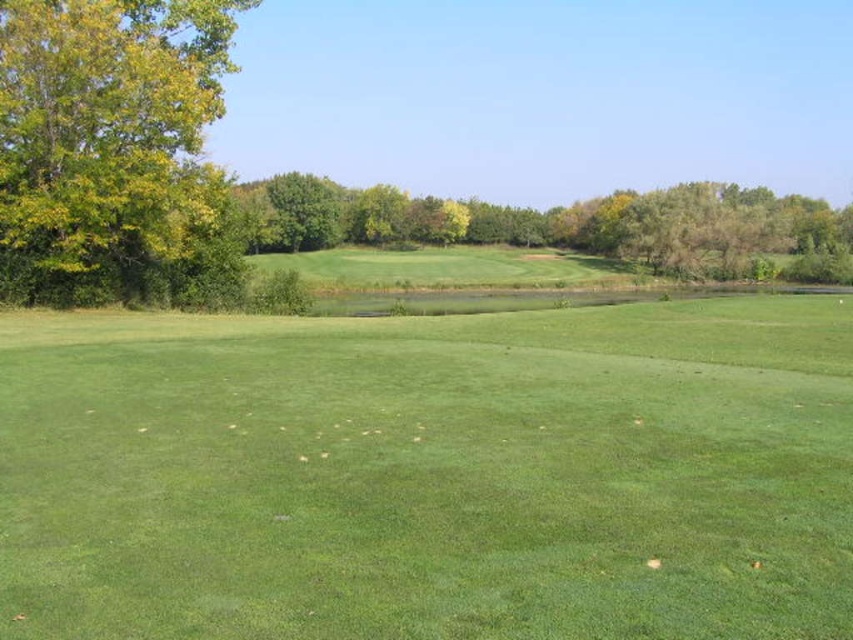
Can you confirm if green leafy tree at left is smaller than green leafy trees at center?

Yes, green leafy tree at left is smaller than green leafy trees at center.

Which of these two, green leafy tree at left or green leafy trees at center, stands shorter?

green leafy tree at left is shorter.

At what (x,y) coordinates should I click in order to perform the action: click on green leafy tree at left. Please return your answer as a coordinate pair (x, y). This screenshot has height=640, width=853. Looking at the image, I should click on (114, 154).

Image resolution: width=853 pixels, height=640 pixels. What do you see at coordinates (432, 476) in the screenshot?
I see `green smooth grass at center` at bounding box center [432, 476].

Locate an element on the screen. green smooth grass at center is located at coordinates (432, 476).

What are the coordinates of `green smooth grass at center` in the screenshot? It's located at (432, 476).

Measure the distance between green leafy tree at left and green leafy tree at center.

The distance of green leafy tree at left from green leafy tree at center is 93.21 meters.

Which of these two, green leafy tree at left or green leafy tree at center, stands taller?

Standing taller between the two is green leafy tree at center.

The height and width of the screenshot is (640, 853). What do you see at coordinates (114, 154) in the screenshot?
I see `green leafy tree at left` at bounding box center [114, 154].

Where is `green leafy tree at left`? This screenshot has height=640, width=853. green leafy tree at left is located at coordinates (114, 154).